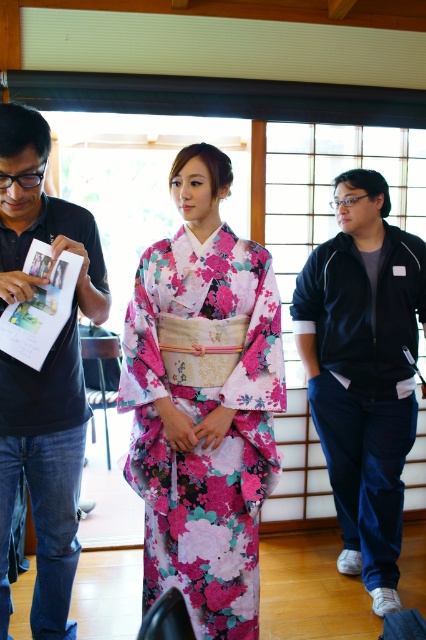
You are standing in a traditional Japanese room and see two points marked in the scene. Which point, point (258,496) or point (49,595), is closer to you?

Point (258,496) is closer to the viewer than point (49,595).